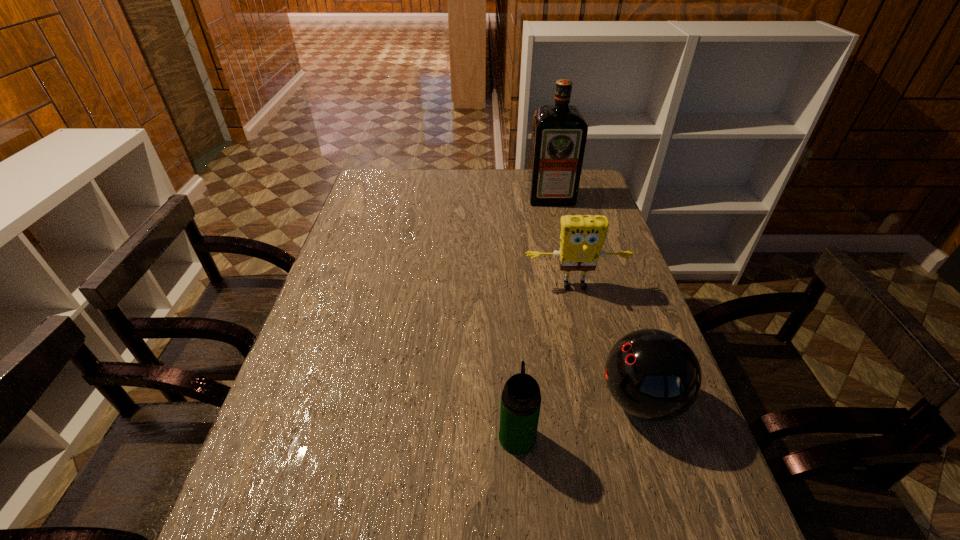
Locate an element on the screen. This screenshot has height=540, width=960. the farthest object is located at coordinates (559, 132).

This screenshot has width=960, height=540. I want to click on liquor, so click(559, 132).

Where is `the third nearest object`? Image resolution: width=960 pixels, height=540 pixels. the third nearest object is located at coordinates (581, 239).

The width and height of the screenshot is (960, 540). Identify the location of the leftmost object. (521, 398).

Find the location of a particular element. The image size is (960, 540). bowling ball is located at coordinates (652, 374).

This screenshot has height=540, width=960. Identify the location of blank space located on the front label of the farthest object. (567, 266).

Find the location of a particular element. vacant region located 0.340m on the face of the second farthest object is located at coordinates (602, 402).

The height and width of the screenshot is (540, 960). I want to click on vacant region located from the spout of the thermos bottle, so click(512, 352).

At what (x,y) coordinates should I click in order to perform the action: click on free space located 0.050m from the spout of the thermos bottle. Please return your answer as a coordinate pair (x, y). This screenshot has height=540, width=960. Looking at the image, I should click on (515, 400).

Where is `free point located from the spout of the thermos bottle`? This screenshot has width=960, height=540. free point located from the spout of the thermos bottle is located at coordinates pyautogui.click(x=511, y=336).